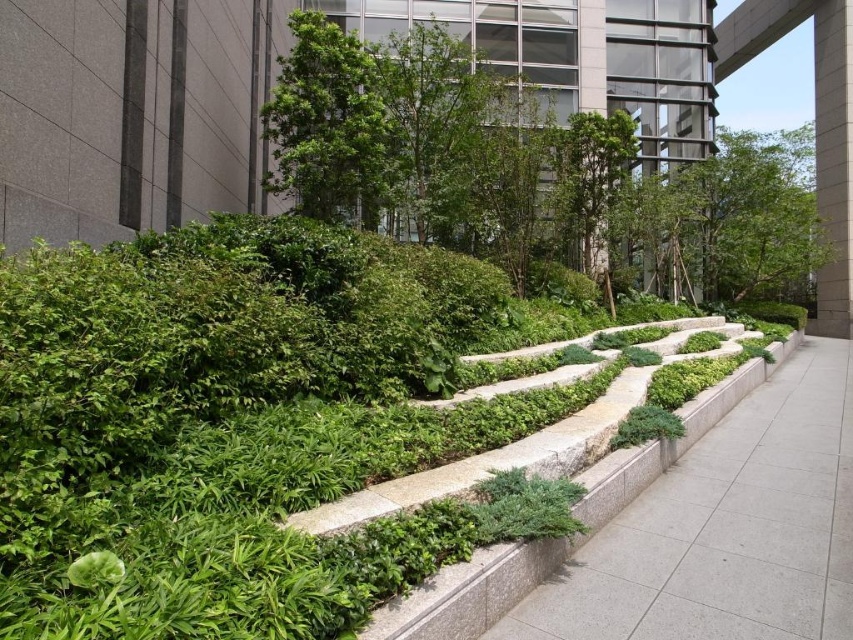
You are a gardener planning to install a new irrigation system. You need to determine which object has a lower height to ensure proper water flow. Which one is shorter between the gray concrete pavement at center and the green leafy tree at upper center?

The gray concrete pavement at center has a lesser height compared to the green leafy tree at upper center, so the gray concrete pavement at center is shorter.

You are a gardener who needs to water the green leafy tree at center. You have a watering can that can spray water up to 5 meters. If you stand on the gray concrete pavement at center, can you reach the tree with your watering can?

The gray concrete pavement at center is 5.19 meters from green leafy tree at center. Since the watering can can only spray up to 5 meters, you cannot reach the tree from the gray concrete pavement at center.

You are standing in the urban garden described. You want to place a small potted plant exactly at the point marked as point (x=726, y=529). According to the scene description, what is the surface type at that location?

The surface type at point (x=726, y=529) is gray concrete pavement at center.